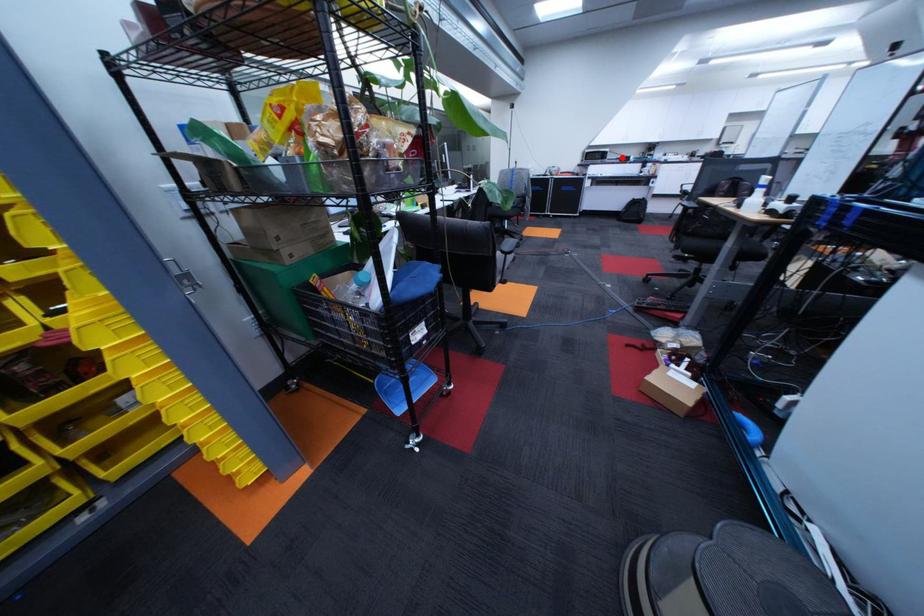
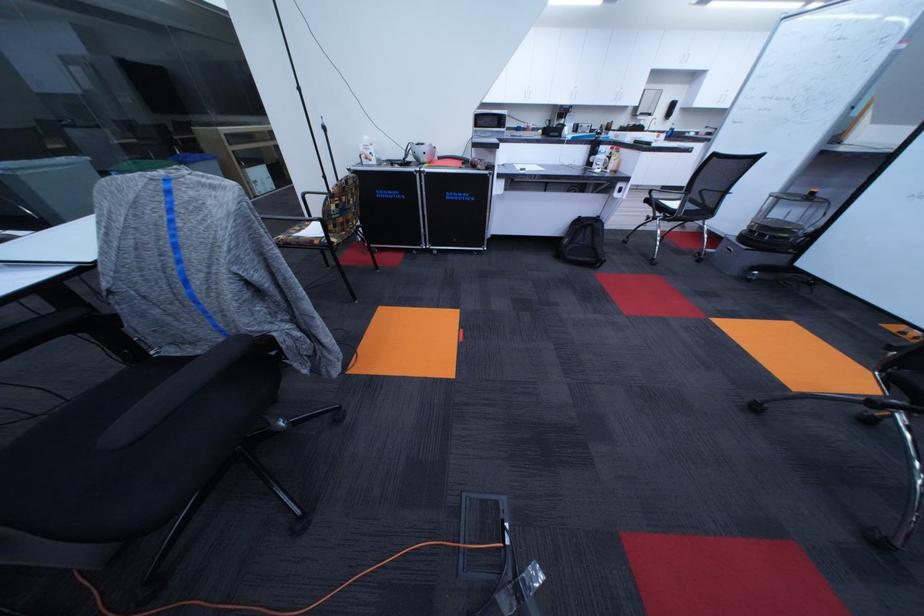
In the second image, find the point that corresponds to the highlighted location in the first image.

(521, 124)